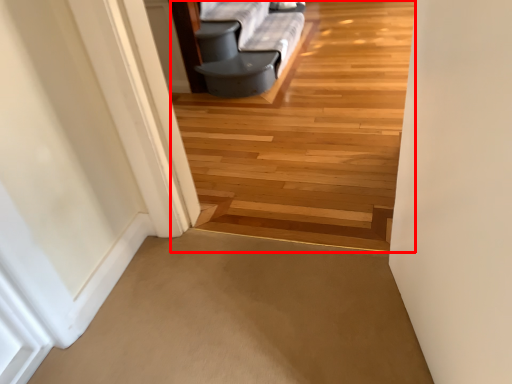
Question: Where is path (annotated by the red box) located in relation to path in the image?

Choices:
 (A) left
 (B) right

Answer: (B)